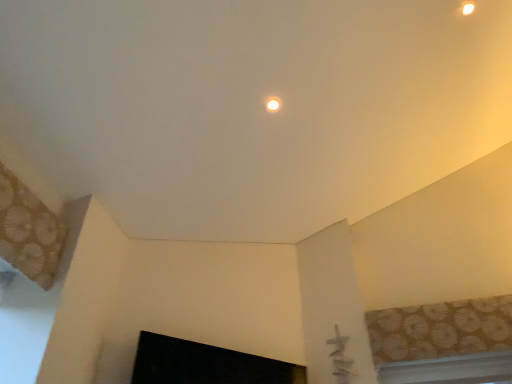
What do you see at coordinates (273, 104) in the screenshot?
I see `matte white light fixture at upper center` at bounding box center [273, 104].

Image resolution: width=512 pixels, height=384 pixels. I want to click on black glossy fireplace at lower center, so click(x=206, y=364).

Describe the element at coordinates (449, 370) in the screenshot. I see `white plastic window at lower right, marked as the second window in a top-to-bottom arrangement` at that location.

Locate an element on the screen. patterned fabric window at upper right, which is counted as the second window, starting from the bottom is located at coordinates (443, 342).

You are a GUI agent. You are given a task and a screenshot of the screen. Output one action in this format:
    pyautogui.click(x=<x>, y=<y>)
    Task: Click on the matte white light fixture at upper center
    The height and width of the screenshot is (384, 512).
    Given the screenshot: What is the action you would take?
    pyautogui.click(x=273, y=104)

Between patterned fabric window at upper right, which is counted as the second window, starting from the bottom, and matte white light fixture at upper center, which one is positioned in front?

matte white light fixture at upper center is closer to the camera.

Looking at their sizes, would you say patterned fabric window at upper right, placed as the 1th window when sorted from top to bottom, is wider or thinner than matte white light fixture at upper center?

Clearly, patterned fabric window at upper right, placed as the 1th window when sorted from top to bottom, has more width compared to matte white light fixture at upper center.

Is patterned fabric window at upper right, placed as the 1th window when sorted from top to bottom, oriented away from matte white light fixture at upper center?

No, patterned fabric window at upper right, placed as the 1th window when sorted from top to bottom, is not facing away from matte white light fixture at upper center.

From a real-world perspective, is patterned fabric window at upper right, placed as the 1th window when sorted from top to bottom, positioned over matte white light fixture at upper center based on gravity?

No.

Between black glossy fireplace at lower center and patterned fabric window at upper right, which is counted as the second window, starting from the bottom, which one has larger width?

black glossy fireplace at lower center.

Does black glossy fireplace at lower center lie behind patterned fabric window at upper right, which is counted as the second window, starting from the bottom?

No.

Which is correct: black glossy fireplace at lower center is inside patterned fabric window at upper right, placed as the 1th window when sorted from top to bottom, or outside of it?

black glossy fireplace at lower center is not inside patterned fabric window at upper right, placed as the 1th window when sorted from top to bottom, it's outside.

Identify the location of lighting that is above the patterned fabric window at upper right, placed as the 1th window when sorted from top to bottom (from the image's perspective). The image size is (512, 384). (273, 104).

From a real-world perspective, which is physically below, matte white light fixture at upper center or patterned fabric window at upper right, which is counted as the second window, starting from the bottom?

patterned fabric window at upper right, which is counted as the second window, starting from the bottom.

Between matte white light fixture at upper center and patterned fabric window at upper right, placed as the 1th window when sorted from top to bottom, which one has smaller width?

Thinner between the two is matte white light fixture at upper center.

Is matte white light fixture at upper center not within patterned fabric window at upper right, which is counted as the second window, starting from the bottom?

Yes.

Considering the relative sizes of matte white light fixture at upper center and white plastic window at lower right, which ranks as the first window in bottom-to-top order, in the image provided, is matte white light fixture at upper center bigger than white plastic window at lower right, which ranks as the first window in bottom-to-top order,?

Incorrect, matte white light fixture at upper center is not larger than white plastic window at lower right, which ranks as the first window in bottom-to-top order.

Is matte white light fixture at upper center with white plastic window at lower right, marked as the second window in a top-to-bottom arrangement?

No, matte white light fixture at upper center is not next to white plastic window at lower right, marked as the second window in a top-to-bottom arrangement.

From a real-world perspective, who is located lower, matte white light fixture at upper center or white plastic window at lower right, marked as the second window in a top-to-bottom arrangement?

white plastic window at lower right, marked as the second window in a top-to-bottom arrangement.

Who is shorter, matte white light fixture at upper center or white plastic window at lower right, marked as the second window in a top-to-bottom arrangement?

white plastic window at lower right, marked as the second window in a top-to-bottom arrangement, is shorter.

Between matte white light fixture at upper center and black glossy fireplace at lower center, which one is positioned behind?

matte white light fixture at upper center.

From the image's perspective, which object appears higher, matte white light fixture at upper center or black glossy fireplace at lower center?

From the image's view, matte white light fixture at upper center is above.

Consider the image. Is matte white light fixture at upper center wider than black glossy fireplace at lower center?

No.

From a real-world perspective, which object stands above the other?

matte white light fixture at upper center, from a real-world perspective.

Find the location of a particular element. fireplace below the white plastic window at lower right, which ranks as the first window in bottom-to-top order (from a real-world perspective) is located at coordinates (206, 364).

From a real-world perspective, which object rests below the other?

black glossy fireplace at lower center.

From the image's perspective, relative to white plastic window at lower right, marked as the second window in a top-to-bottom arrangement, is black glossy fireplace at lower center above or below?

From the image's perspective, black glossy fireplace at lower center appears above white plastic window at lower right, marked as the second window in a top-to-bottom arrangement.

Is black glossy fireplace at lower center further to the viewer compared to white plastic window at lower right, which ranks as the first window in bottom-to-top order?

No, black glossy fireplace at lower center is closer to the viewer.

Does black glossy fireplace at lower center have a smaller size compared to matte white light fixture at upper center?

Incorrect, black glossy fireplace at lower center is not smaller in size than matte white light fixture at upper center.

Between black glossy fireplace at lower center and matte white light fixture at upper center, which one appears on the right side from the viewer's perspective?

Positioned to the right is matte white light fixture at upper center.

The width and height of the screenshot is (512, 384). I want to click on fireplace to the left of matte white light fixture at upper center, so click(206, 364).

Find the location of a particular element. lighting above the patterned fabric window at upper right, which is counted as the second window, starting from the bottom (from the image's perspective) is located at coordinates (273, 104).

Identify the location of fireplace below the patterned fabric window at upper right, placed as the 1th window when sorted from top to bottom (from a real-world perspective). (206, 364).

In the scene shown: Estimate the real-world distances between objects in this image. Which object is closer to patterned fabric window at upper right, which is counted as the second window, starting from the bottom, matte white light fixture at upper center or white plastic window at lower right, marked as the second window in a top-to-bottom arrangement?

white plastic window at lower right, marked as the second window in a top-to-bottom arrangement, lies closer to patterned fabric window at upper right, which is counted as the second window, starting from the bottom, than the other object.

In the scene shown: Based on their spatial positions, is patterned fabric window at upper right, which is counted as the second window, starting from the bottom, or matte white light fixture at upper center closer to white plastic window at lower right, which ranks as the first window in bottom-to-top order?

patterned fabric window at upper right, which is counted as the second window, starting from the bottom, is positioned closer to the anchor white plastic window at lower right, which ranks as the first window in bottom-to-top order.

Looking at the image, which one is located further to matte white light fixture at upper center, patterned fabric window at upper right, placed as the 1th window when sorted from top to bottom, or white plastic window at lower right, marked as the second window in a top-to-bottom arrangement?

white plastic window at lower right, marked as the second window in a top-to-bottom arrangement, is further to matte white light fixture at upper center.

When comparing their distances from matte white light fixture at upper center, does black glossy fireplace at lower center or white plastic window at lower right, marked as the second window in a top-to-bottom arrangement, seem further?

Among the two, white plastic window at lower right, marked as the second window in a top-to-bottom arrangement, is located further to matte white light fixture at upper center.

When comparing their distances from white plastic window at lower right, marked as the second window in a top-to-bottom arrangement, does matte white light fixture at upper center or black glossy fireplace at lower center seem closer?

The object closer to white plastic window at lower right, marked as the second window in a top-to-bottom arrangement, is black glossy fireplace at lower center.

From the image, which object appears to be nearer to matte white light fixture at upper center, patterned fabric window at upper right, which is counted as the second window, starting from the bottom, or black glossy fireplace at lower center?

black glossy fireplace at lower center.

Estimate the real-world distances between objects in this image. Which object is closer to white plastic window at lower right, marked as the second window in a top-to-bottom arrangement, black glossy fireplace at lower center or matte white light fixture at upper center?

Based on the image, black glossy fireplace at lower center appears to be nearer to white plastic window at lower right, marked as the second window in a top-to-bottom arrangement.

When comparing their distances from black glossy fireplace at lower center, does patterned fabric window at upper right, placed as the 1th window when sorted from top to bottom, or white plastic window at lower right, marked as the second window in a top-to-bottom arrangement, seem further?

white plastic window at lower right, marked as the second window in a top-to-bottom arrangement, is positioned further to the anchor black glossy fireplace at lower center.

Find the location of a particular element. The image size is (512, 384). fireplace between matte white light fixture at upper center and white plastic window at lower right, marked as the second window in a top-to-bottom arrangement, from top to bottom is located at coordinates (206, 364).

Locate an element on the screen. window located between black glossy fireplace at lower center and patterned fabric window at upper right, placed as the 1th window when sorted from top to bottom, in the left-right direction is located at coordinates (449, 370).

Locate an element on the screen. The height and width of the screenshot is (384, 512). window that lies between matte white light fixture at upper center and white plastic window at lower right, marked as the second window in a top-to-bottom arrangement, from top to bottom is located at coordinates (443, 342).

Locate an element on the screen. The image size is (512, 384). window between matte white light fixture at upper center and black glossy fireplace at lower center from top to bottom is located at coordinates (443, 342).